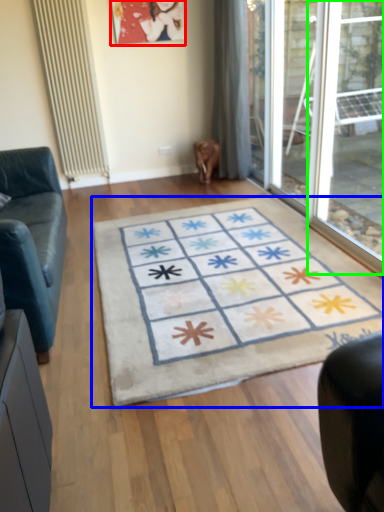
Question: Estimate the real-world distances between objects in this image. Which object is farther from picture frame (highlighted by a red box), doormat (highlighted by a blue box) or window (highlighted by a green box)?

Choices:
 (A) doormat
 (B) window

Answer: (A)